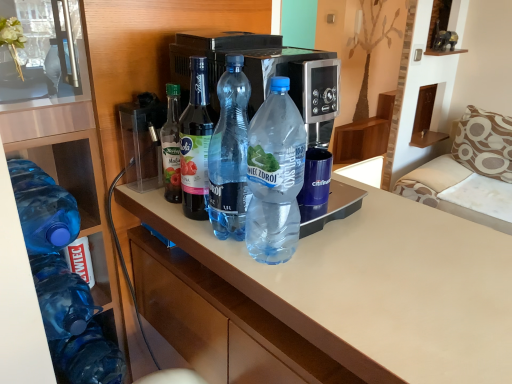
Question: Visually, is transparent plastic container at upper left positioned to the left or to the right of blue translucent bottle at center, which appears as the 1th bottle when viewed from the right?

Choices:
 (A) right
 (B) left

Answer: (B)

Question: From the image's perspective, is transparent plastic container at upper left above or below blue translucent bottle at center, which appears as the 1th bottle when viewed from the right?

Choices:
 (A) above
 (B) below

Answer: (A)

Question: Considering the real-world distances, which object is farthest from the blue translucent bottle at center, which appears as the 1th bottle when viewed from the right?

Choices:
 (A) beige fabric sofa at right
 (B) blue translucent bottle at left, placed as the second bottle when sorted from left to right
 (C) blue translucent bottle at left, the 1th bottle in the left-to-right sequence
 (D) transparent plastic container at upper left
 (E) transparent plastic bottle at center, which is counted as the third bottle, starting from the right

Answer: (A)

Question: Which object is positioned closest to the transparent plastic container at upper left?

Choices:
 (A) transparent plastic bottle at center, which is counted as the third bottle, starting from the right
 (B) translucent plastic bottles at center
 (C) transparent plastic bottle at center, the second bottle when ordered from right to left
 (D) blue translucent bottle at left, the 5th bottle viewed from the right
 (E) beige fabric sofa at right

Answer: (A)